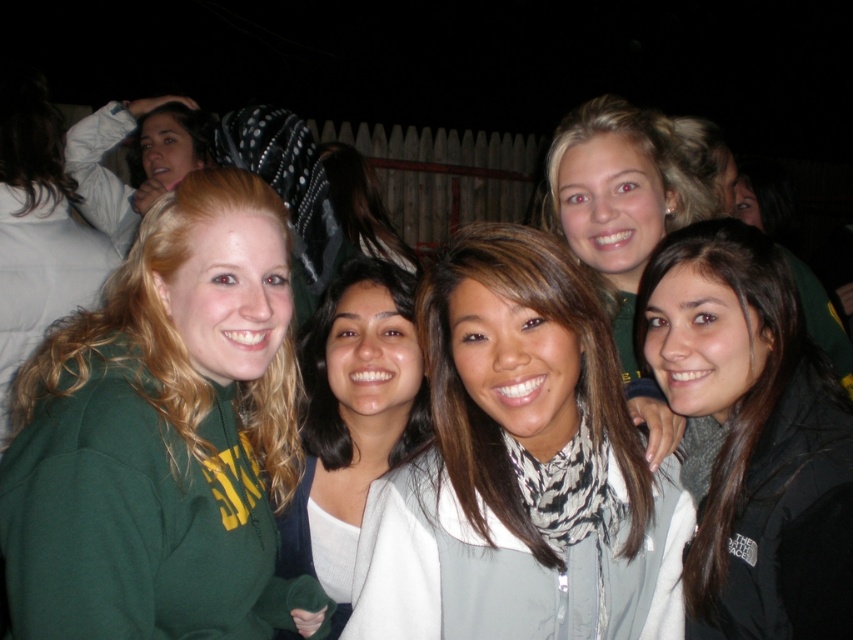
Question: Is black fleece jacket at lower right further to the viewer compared to white matte scarf at center?

Choices:
 (A) yes
 (B) no

Answer: (B)

Question: Is green fleece sweatshirt at left to the left of white matte scarf at center from the viewer's perspective?

Choices:
 (A) yes
 (B) no

Answer: (A)

Question: Where is white textured scarf at center located in relation to black fleece jacket at lower right in the image?

Choices:
 (A) above
 (B) below

Answer: (B)

Question: Which point is closer to the camera?

Choices:
 (A) white textured scarf at center
 (B) green fleece sweatshirt at left

Answer: (B)

Question: Which point is farther from the camera taking this photo?

Choices:
 (A) (735, 522)
 (B) (577, 433)

Answer: (A)

Question: Which of the following is the farthest from the observer?

Choices:
 (A) green fleece sweatshirt at left
 (B) white matte scarf at center
 (C) white textured scarf at center
 (D) black fleece jacket at lower right

Answer: (B)